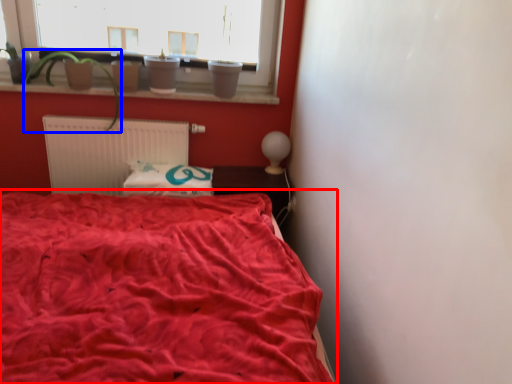
Question: Which point is closer to the camera, bed (highlighted by a red box) or plant (highlighted by a blue box)?

Choices:
 (A) bed
 (B) plant

Answer: (A)